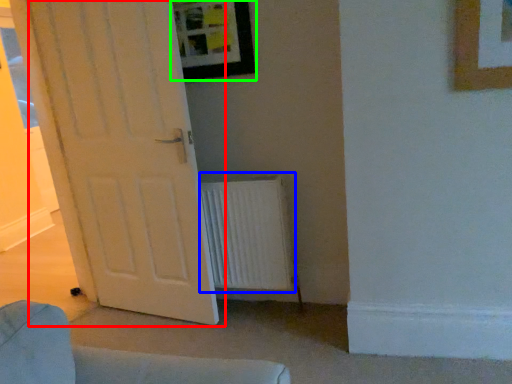
Question: Based on their relative distances, which object is nearer to door (highlighted by a red box)? Choose from radiator (highlighted by a blue box) and picture frame (highlighted by a green box).

Choices:
 (A) radiator
 (B) picture frame

Answer: (A)